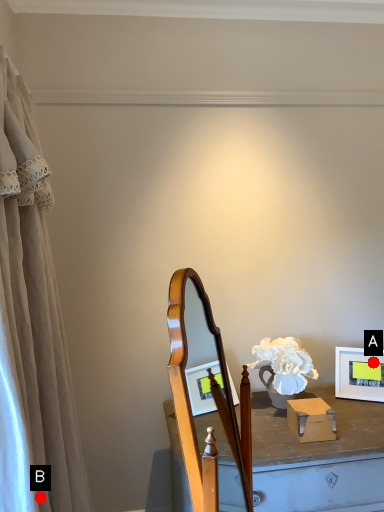
Question: Two points are circled on the image, labeled by A and B beside each circle. Which point is closer to the camera?

Choices:
 (A) A is closer
 (B) B is closer

Answer: (B)